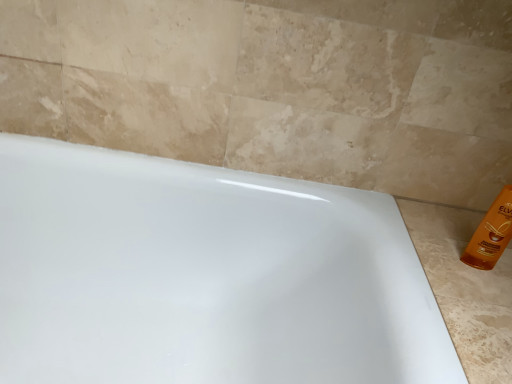
Question: Does orange glossy bottle at right have a lesser width compared to white glossy bathtub at center?

Choices:
 (A) no
 (B) yes

Answer: (B)

Question: Is orange glossy bottle at right closer to the viewer compared to white glossy bathtub at center?

Choices:
 (A) no
 (B) yes

Answer: (A)

Question: Is orange glossy bottle at right surrounding white glossy bathtub at center?

Choices:
 (A) no
 (B) yes

Answer: (A)

Question: Is orange glossy bottle at right oriented towards white glossy bathtub at center?

Choices:
 (A) no
 (B) yes

Answer: (A)

Question: Can you confirm if orange glossy bottle at right is bigger than white glossy bathtub at center?

Choices:
 (A) no
 (B) yes

Answer: (A)

Question: Is orange glossy bottle at right smaller than white glossy bathtub at center?

Choices:
 (A) yes
 (B) no

Answer: (A)

Question: From a real-world perspective, is white glossy bathtub at center positioned under orange glossy bottle at right based on gravity?

Choices:
 (A) yes
 (B) no

Answer: (A)

Question: From the image's perspective, is white glossy bathtub at center over orange glossy bottle at right?

Choices:
 (A) no
 (B) yes

Answer: (A)

Question: Is white glossy bathtub at center shorter than orange glossy bottle at right?

Choices:
 (A) no
 (B) yes

Answer: (A)

Question: Are white glossy bathtub at center and orange glossy bottle at right far apart?

Choices:
 (A) no
 (B) yes

Answer: (A)

Question: Does white glossy bathtub at center appear on the left side of orange glossy bottle at right?

Choices:
 (A) no
 (B) yes

Answer: (B)

Question: Considering the relative positions of white glossy bathtub at center and orange glossy bottle at right in the image provided, is white glossy bathtub at center in front of orange glossy bottle at right?

Choices:
 (A) yes
 (B) no

Answer: (A)

Question: From a real-world perspective, is orange glossy bottle at right physically located above or below white glossy bathtub at center?

Choices:
 (A) below
 (B) above

Answer: (B)